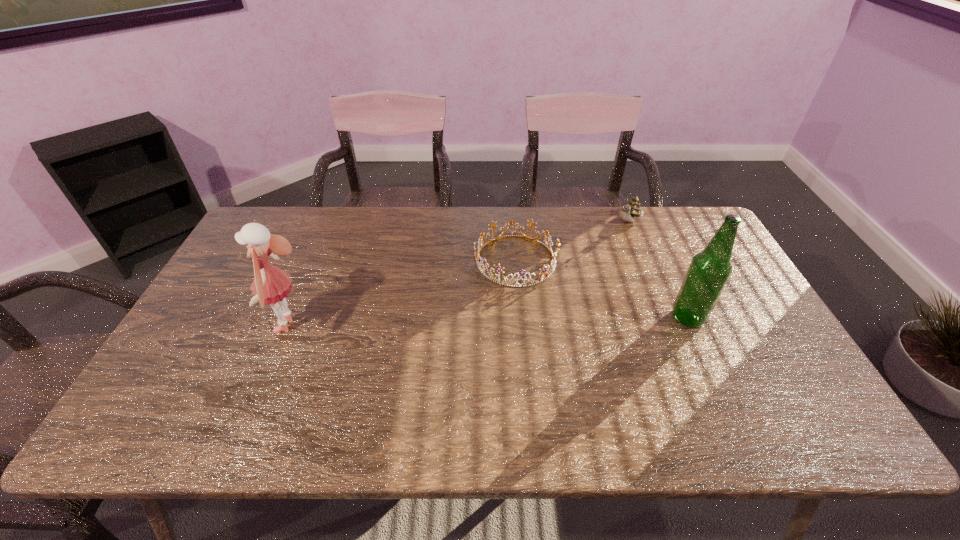
At what (x,y) coordinates should I click in order to perform the action: click on vacant space positioned 0.140m on the label of the beer bottle. Please return your answer as a coordinate pair (x, y). The height and width of the screenshot is (540, 960). Looking at the image, I should click on (619, 318).

Find the location of a particular element. The image size is (960, 540). vacant area situated on the label of the beer bottle is located at coordinates (593, 318).

The width and height of the screenshot is (960, 540). Identify the location of vacant space located 0.200m on the front-facing side of the third object from right to left. (467, 333).

Image resolution: width=960 pixels, height=540 pixels. What are the coordinates of `vacant space located on the front-facing side of the third object from right to left` in the screenshot? It's located at (446, 364).

This screenshot has width=960, height=540. I want to click on vacant region located 0.210m on the front-facing side of the third object from right to left, so click(465, 336).

Where is `vacant space located on the face of the snail`? vacant space located on the face of the snail is located at coordinates (597, 260).

Where is `free space located on the face of the snail`? Image resolution: width=960 pixels, height=540 pixels. free space located on the face of the snail is located at coordinates (612, 242).

Locate an element on the screen. vacant point located 0.130m on the face of the snail is located at coordinates (607, 249).

Find the location of a particular element. The image size is (960, 540). tiara that is at the far edge is located at coordinates coord(498,268).

Find the location of `snail at the far edge`. snail at the far edge is located at coordinates (633, 209).